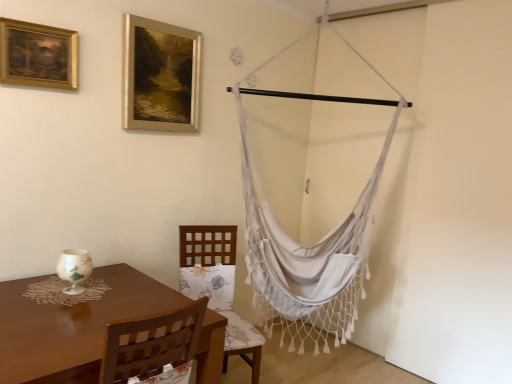
Question: In terms of size, does woodenchair at center appear bigger or smaller than gold metallic picture frame at upper center, which ranks as the second picture frame in left-to-right order?

Choices:
 (A) small
 (B) big

Answer: (B)

Question: In terms of height, does woodenchair at center look taller or shorter compared to gold metallic picture frame at upper center, which ranks as the second picture frame in left-to-right order?

Choices:
 (A) tall
 (B) short

Answer: (A)

Question: Which object is the closest to the woodenchair at center?

Choices:
 (A) white macrame hammock at right
 (B) gold metallic picture frame at upper center, which ranks as the second picture frame in left-to-right order
 (C) brown wooden table at lower left
 (D) gold-framed painting at upper left, the second picture frame when ordered from back to front

Answer: (A)

Question: Estimate the real-world distances between objects in this image. Which object is closer to the gold-framed painting at upper left, which appears as the first picture frame when viewed from the left?

Choices:
 (A) gold metallic picture frame at upper center, placed as the first picture frame when sorted from right to left
 (B) white macrame hammock at right
 (C) woodenchair at center
 (D) brown wooden table at lower left

Answer: (A)